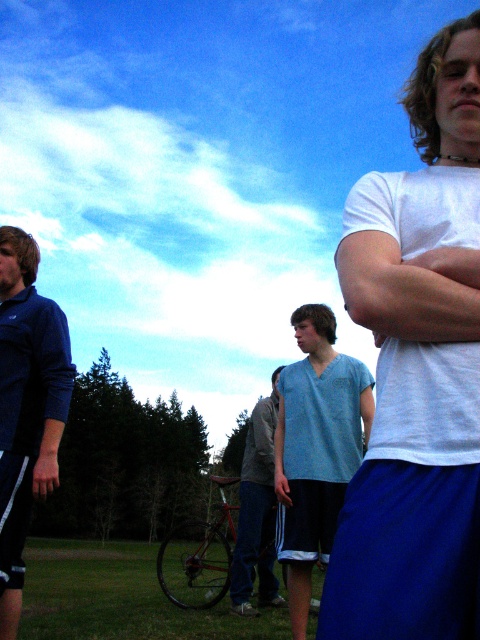
You are a photographer trying to capture a group photo of the dark blue jersey at left and the light blue cotton shirt at center. Based on their sizes in the image, which one should you focus on first to ensure both are in frame?

The dark blue jersey at left occupies less space than the light blue cotton shirt at center, so you should focus on the light blue cotton shirt at center first to ensure both are in frame.

You are a photographer trying to capture a group photo of the light blue fabric shirt at center and the dark blue jersey at left. Which of the two should you zoom in on to ensure their clothing details are clear?

The light blue fabric shirt at center has a larger size compared to the dark blue jersey at left, so you should zoom in on the light blue fabric shirt at center to ensure their clothing details are clear.